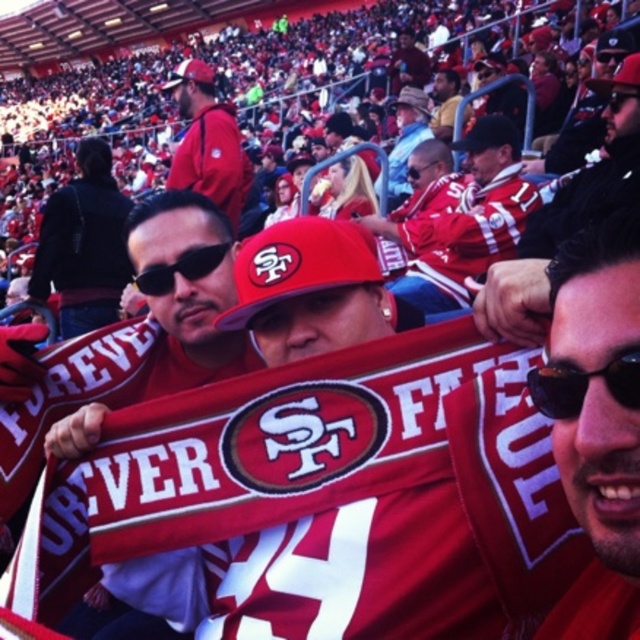
Is matte red scarf at center closer to camera compared to matte red cap at upper center?

Yes, matte red scarf at center is in front of matte red cap at upper center.

Between matte red scarf at center and matte red cap at upper center, which one is positioned lower?

matte red scarf at center is lower down.

I want to click on matte red scarf at center, so click(125, 342).

Between black plastic goggles at right and black plastic sunglasses at center, which one has less height?

black plastic goggles at right

Is point (624, 364) positioned before point (422, 166)?

Yes, it is.

Image resolution: width=640 pixels, height=640 pixels. I want to click on black plastic goggles at right, so click(582, 385).

Can you confirm if matte red cap at upper center is bigger than black plastic sunglasses at center?

Indeed, matte red cap at upper center has a larger size compared to black plastic sunglasses at center.

Who is positioned more to the right, matte red cap at upper center or black plastic sunglasses at center?

black plastic sunglasses at center

Image resolution: width=640 pixels, height=640 pixels. What do you see at coordinates (208, 141) in the screenshot?
I see `matte red cap at upper center` at bounding box center [208, 141].

This screenshot has width=640, height=640. What are the coordinates of `matte red cap at upper center` in the screenshot? It's located at (208, 141).